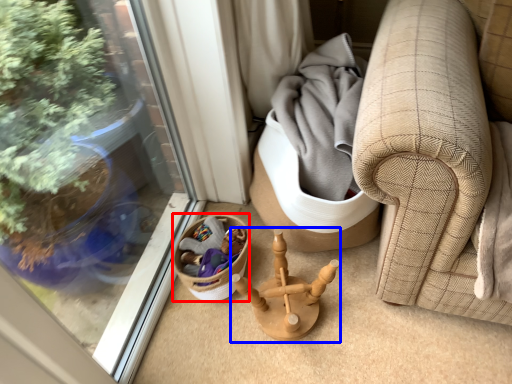
Question: Which point is further to the camera, basket (highlighted by a red box) or miniature (highlighted by a blue box)?

Choices:
 (A) basket
 (B) miniature

Answer: (A)